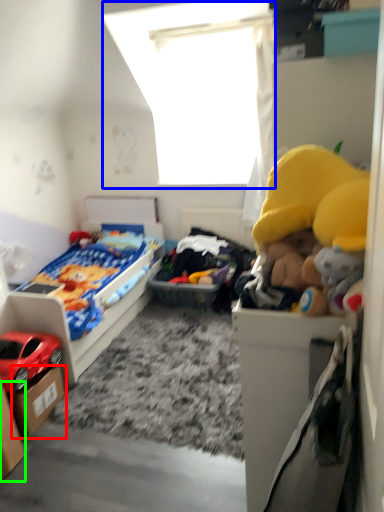
Question: Which object is the closest to the storage box (highlighted by a red box)? Choose among these: window screen (highlighted by a blue box) or storage box (highlighted by a green box).

Choices:
 (A) window screen
 (B) storage box

Answer: (B)